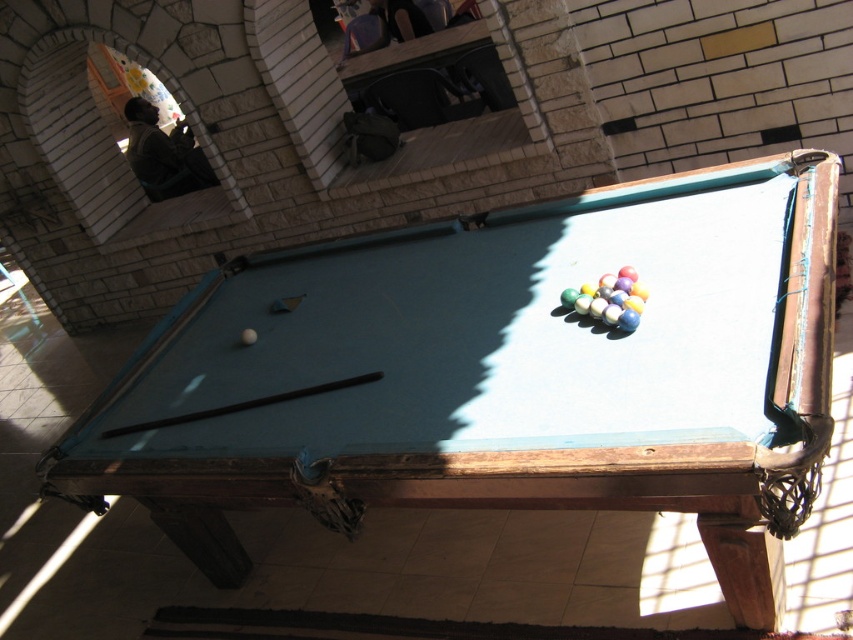
Question: Observing the image, what is the correct spatial positioning of blue felt pool table at center in reference to brown wood cue at center?

Choices:
 (A) left
 (B) right

Answer: (B)

Question: Among these points, which one is farthest from the camera?

Choices:
 (A) (496, 278)
 (B) (347, 385)

Answer: (A)

Question: Which of the following is the farthest from the observer?

Choices:
 (A) blue felt pool table at center
 (B) brown wood cue at center

Answer: (B)

Question: Is blue felt pool table at center positioned in front of brown wood cue at center?

Choices:
 (A) yes
 (B) no

Answer: (A)

Question: Which point is closer to the camera?

Choices:
 (A) coord(300,394)
 (B) coord(802,312)

Answer: (B)

Question: From the image, what is the correct spatial relationship of blue felt pool table at center in relation to brown wood cue at center?

Choices:
 (A) left
 (B) right

Answer: (B)